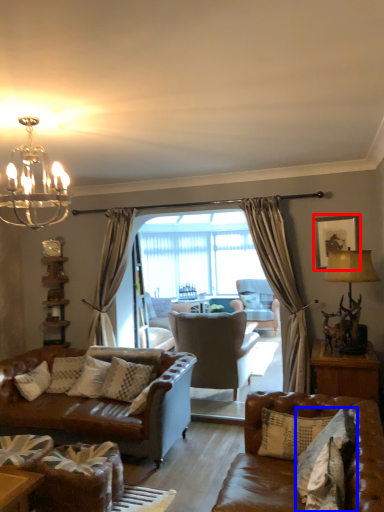
Question: Among these objects, which one is nearest to the camera, picture frame (highlighted by a red box) or pillow (highlighted by a blue box)?

Choices:
 (A) picture frame
 (B) pillow

Answer: (B)